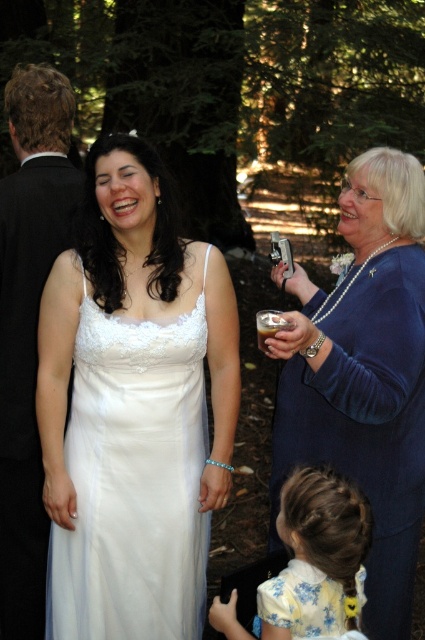
You are a photographer at the wedding and need to adjust the camera angle so both the white satin dress at center and the yellow floral dress at lower center are in focus. Which dress should you focus on first to ensure both are sharp?

You should focus on the white satin dress at center first because it is taller than the yellow floral dress at lower center, so starting with the taller one ensures depth of field covers both.

Based on the scene description, where is the blue velvet dress at right located in the image?

The blue velvet dress at right is located at point 0.588 on the x axis and 0.859 on the y axis.

You are a photographer at the event and need to ensure all guests can be seen in a group photo. The black satin suit at left and the floral silk dress at lower center are in the frame. Which of these two items is larger in size?

The black satin suit at left is larger in size compared to the floral silk dress at lower center according to the description.